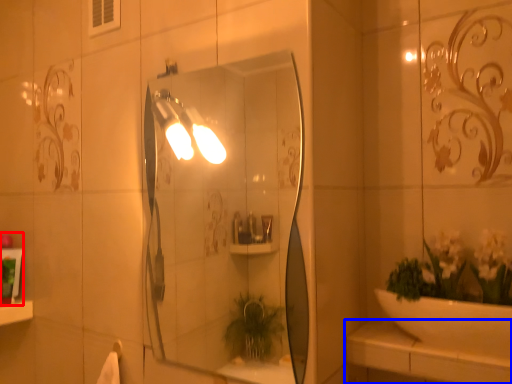
Question: Which object is further to the camera taking this photo, toiletry (highlighted by a red box) or counter top (highlighted by a blue box)?

Choices:
 (A) toiletry
 (B) counter top

Answer: (A)